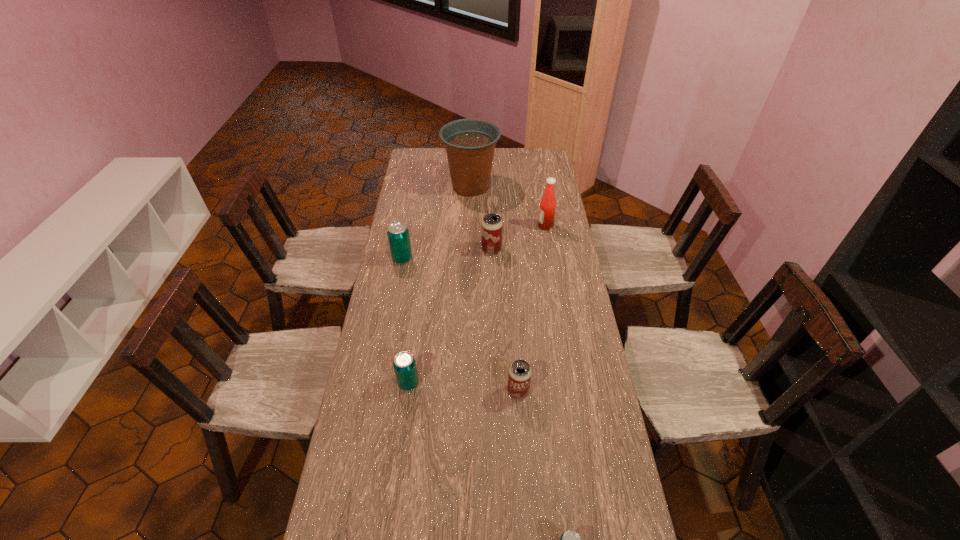
Find the location of `red beer can that is the closest to the sixth object from left to right`. red beer can that is the closest to the sixth object from left to right is located at coordinates (519, 377).

At what (x,y) coordinates should I click in order to perform the action: click on red beer can that stands as the second closest to the second beer can from left to right. Please return your answer as a coordinate pair (x, y). The image size is (960, 540). Looking at the image, I should click on (491, 226).

What are the coordinates of `the closest teal beer can to the leftmost beer can` in the screenshot? It's located at (404, 364).

Identify the location of teal beer can that is the nearest to the flowerpot. This screenshot has width=960, height=540. (398, 234).